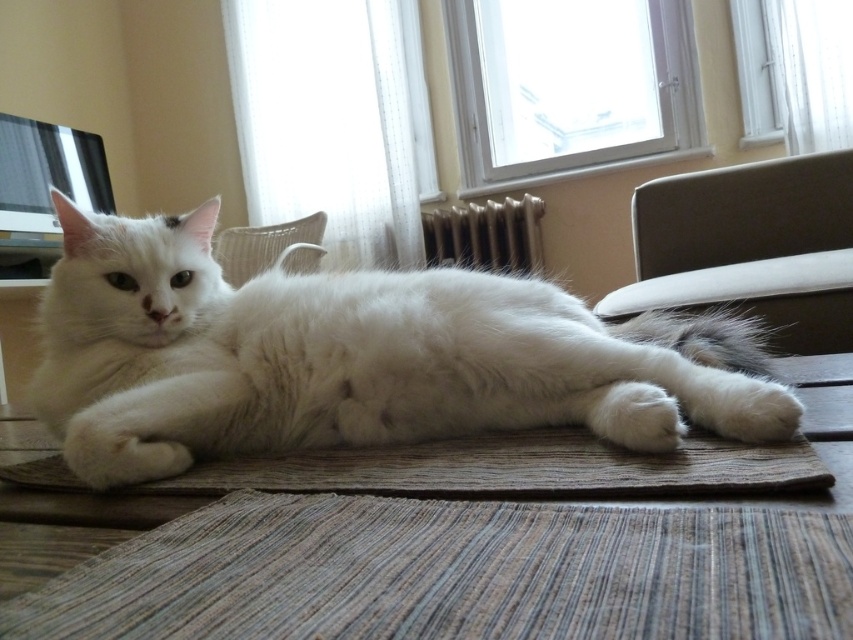
You are trying to place a small potted plant between the brown woven mat at center and the natural woven mat at center. Which mat should you place the plant closer to if you want it to be near the wider mat?

The brown woven mat at center is wider than the natural woven mat at center, so you should place the plant closer to the brown woven mat at center.

You are a small toy that is 30 cm tall. You are placed on the natural woven mat at center and want to roll towards the white fabric chair at upper center. Can you reach the chair without falling off the mat?

The natural woven mat at center is shorter than the white fabric chair at upper center, so the toy can roll towards the chair as the mat is shorter in height but the question is about the mat being shorter vertically. However, since the mat is at center and the chair is at upper center, the toy can roll upwards towards the chair as the vertical distance allows.

You are trying to place a small potted plant between the brown woven mat at center and the natural woven mat at center. Since both mats are at the same center position, which mat should you place the plant closer to based on their heights?

The brown woven mat at center has a greater height compared to the natural woven mat at center, so you should place the plant closer to the brown woven mat at center to ensure stability.